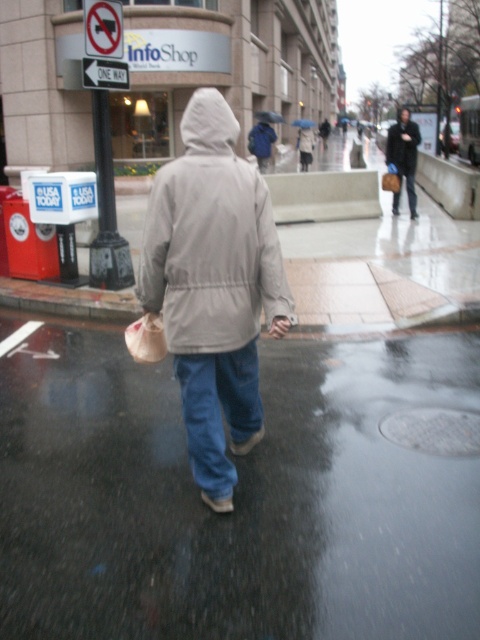
Which is more to the left, light gray matte jacket at center or blue denim jeans at lower right?

From the viewer's perspective, light gray matte jacket at center appears more on the left side.

Which is below, light gray matte jacket at center or blue denim jeans at lower right?

Answer: light gray matte jacket at center

Between point (190, 250) and point (409, 211), which one is positioned behind?

Point (409, 211)

Where is `light gray matte jacket at center`? light gray matte jacket at center is located at coordinates (212, 240).

Find the location of a particular element. light gray matte jacket at center is located at coordinates (212, 240).

Can you confirm if blue backpack at center is shorter than blue denim jeans at lower right?

No, blue backpack at center is not shorter than blue denim jeans at lower right.

Can you confirm if blue backpack at center is wider than blue denim jeans at lower right?

Yes, blue backpack at center is wider than blue denim jeans at lower right.

Does point (260, 124) come closer to viewer compared to point (394, 198)?

No.

Identify the location of blue backpack at center. This screenshot has height=640, width=480. (262, 144).